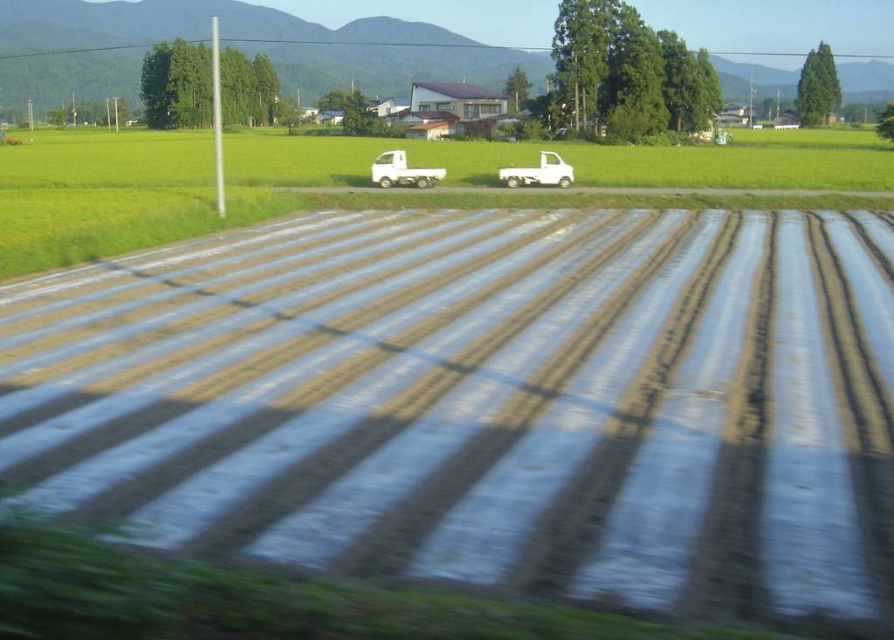
You are standing at the edge of the field and want to walk to the point marked as point [443,170]. However, there is an obstacle located at point [173,236]. Will you encounter the obstacle before reaching your destination?

Yes, you will encounter the obstacle at point [173,236] before reaching the destination at point [443,170] because point [173,236] is closer to the viewer than point [443,170].

You are a farmer standing on the dirt path between the two trucks. You want to move your equipment from the white plastic truck at center to the white matte truck at center. Which truck should you approach first if you want to reach the closer one?

The white plastic truck at center is closer to you, so you should approach the white plastic truck at center first.